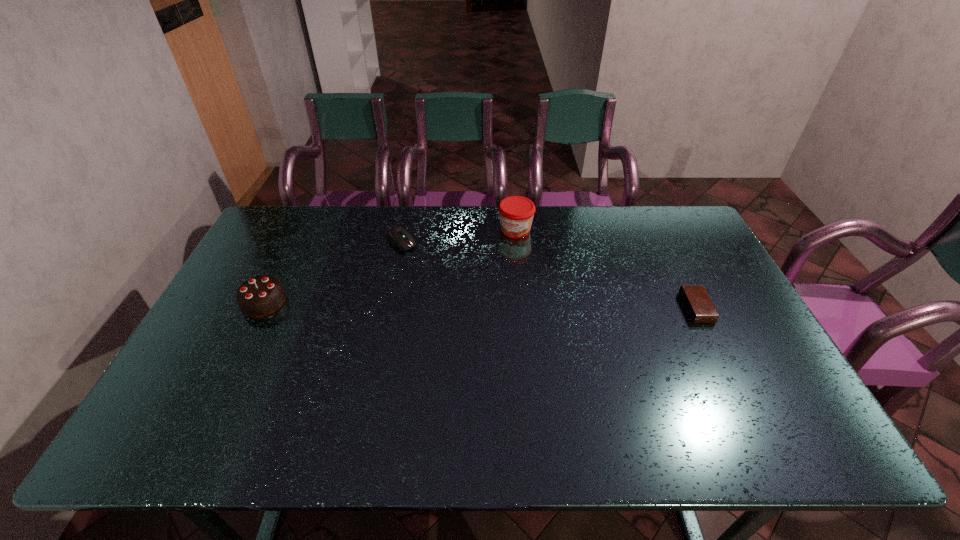
Image resolution: width=960 pixels, height=540 pixels. In the image, there is a desktop. In order to click on free region at the left edge in this screenshot , I will do `click(242, 265)`.

In the image, there is a desktop. Where is `vacant space at the right edge`? The image size is (960, 540). vacant space at the right edge is located at coordinates (751, 363).

The width and height of the screenshot is (960, 540). I want to click on vacant space at the far left corner of the desktop, so click(x=264, y=247).

The width and height of the screenshot is (960, 540). Identify the location of free space at the near left corner of the desktop. (198, 382).

Identify the location of free spot at the far right corner of the desktop. This screenshot has height=540, width=960. (684, 227).

Identify the location of vacant point located between the chocolate cake and the third object from left to right. (390, 266).

The image size is (960, 540). I want to click on free space between the third tallest object and the chocolate cake, so click(x=332, y=272).

At what (x,y) coordinates should I click in order to perform the action: click on free space between the third object from right to left and the third object from left to right. Please return your answer as a coordinate pair (x, y). Looking at the image, I should click on (458, 236).

The width and height of the screenshot is (960, 540). I want to click on vacant region between the second object from left to right and the leftmost object, so click(332, 272).

Identify the location of unoccupied position between the chocolate cake and the rightmost object. (480, 305).